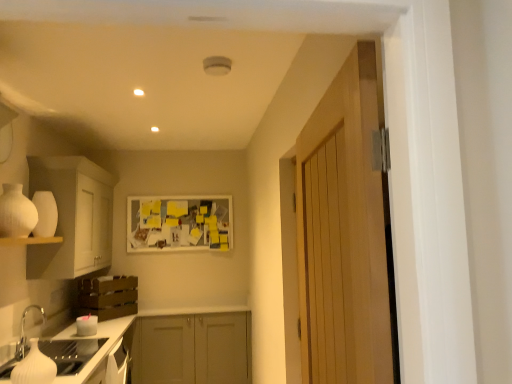
Question: Relative to white glossy countertop at lower left, is white matte vase at left in front or behind?

Choices:
 (A) front
 (B) behind

Answer: (A)

Question: Considering the positions of point (9, 183) and point (96, 364), is point (9, 183) closer or farther from the camera than point (96, 364)?

Choices:
 (A) closer
 (B) farther

Answer: (A)

Question: Which is farther from the wooden door at right?

Choices:
 (A) matte gray cabinets at center, which is the first cabinetry in bottom-to-top order
 (B) white matte vase at left
 (C) white glossy countertop at lower left
 (D) white matte cabinet at left, which is the first cabinetry in top-to-bottom order
 (E) white glossy sink at lower left

Answer: (A)

Question: Which is farther from the white glossy sink at lower left?

Choices:
 (A) yellow paper at center
 (B) brown wooden crate at lower left, which is counted as the second cabinetry, starting from the bottom
 (C) matte gray cabinets at center, which is the first cabinetry in bottom-to-top order
 (D) white matte cabinet at left, which is the first cabinetry in top-to-bottom order
 (E) white glossy countertop at lower left

Answer: (A)